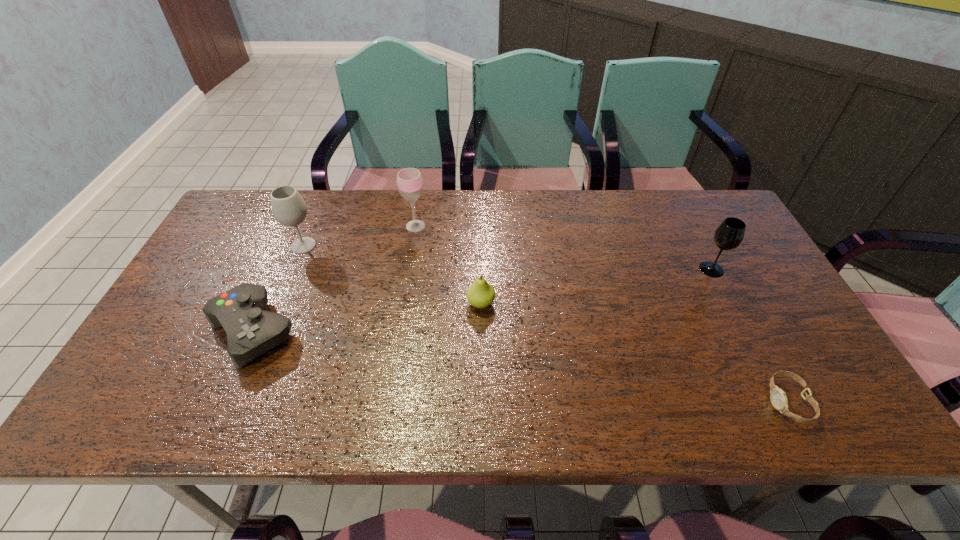
I want to click on watch, so click(778, 397).

Where is `vacant space situated on the left of the second farthest object`? vacant space situated on the left of the second farthest object is located at coordinates (252, 246).

This screenshot has width=960, height=540. I want to click on vacant space situated 0.400m on the front of the farthest object, so click(x=397, y=341).

Where is `vacant space located on the left of the fourth nearest object`? vacant space located on the left of the fourth nearest object is located at coordinates (582, 269).

The height and width of the screenshot is (540, 960). Identify the location of vacant space located 0.320m on the left of the fourth tallest object. point(345,303).

You are a GUI agent. You are given a task and a screenshot of the screen. Output one action in this format:
    pyautogui.click(x=<x>, y=<y>)
    Task: Click on the free location located on the right of the second shortest object
    
    Given the screenshot: What is the action you would take?
    pyautogui.click(x=328, y=331)

I want to click on vacant area situated 0.400m on the face of the watch, so click(x=586, y=401).

Locate an element on the screen. The width and height of the screenshot is (960, 540). vacant space located on the face of the watch is located at coordinates (618, 401).

This screenshot has height=540, width=960. I want to click on vacant space located 0.300m on the face of the watch, so click(x=632, y=401).

At what (x,y) coordinates should I click in order to perform the action: click on object at the near edge. Please return your answer as a coordinate pair (x, y). The width and height of the screenshot is (960, 540). Looking at the image, I should click on (778, 397).